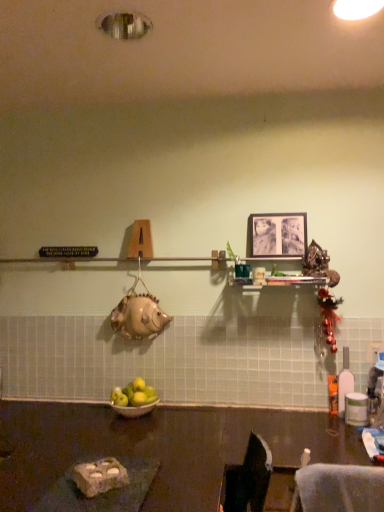
In order to face dark brown polished table at lower center, should I rotate leftwards or rightwards?

To align with it, rotate left about 2.910°.

Where is `dark brown polished table at lower center`? dark brown polished table at lower center is located at coordinates (160, 447).

Which object is wider, green matte apples at center or silver metallic bowl at center?

silver metallic bowl at center is wider.

Is green matte apples at center touching silver metallic bowl at center?

Yes.

Can you tell me how much green matte apples at center and silver metallic bowl at center differ in facing direction?

0.000387 degrees.

Is silver metallic bowl at center at the back of green matte apples at center?

No, silver metallic bowl at center is not at the back of green matte apples at center.

Who is taller, silver metallic bowl at center or translucent plastic bottle at right?

translucent plastic bottle at right is taller.

Is silver metallic bowl at center bigger than translucent plastic bottle at right?

Yes.

Is translucent plastic bottle at right a part of silver metallic bowl at center?

No.

Is silver metallic bowl at center far from translucent plastic bottle at right?

No, silver metallic bowl at center is not far away from translucent plastic bottle at right.

Is translucent plastic bottle at right bigger than dark brown polished table at lower center?

Incorrect, translucent plastic bottle at right is not larger than dark brown polished table at lower center.

From the image's perspective, is translucent plastic bottle at right on dark brown polished table at lower center?

Indeed, from the image's perspective, translucent plastic bottle at right is shown above dark brown polished table at lower center.

Is translucent plastic bottle at right taller or shorter than dark brown polished table at lower center?

Considering their sizes, translucent plastic bottle at right has less height than dark brown polished table at lower center.

From a real-world perspective, relative to dark brown polished table at lower center, is translucent plastic bottle at right vertically above or below?

Clearly, from a real-world perspective, translucent plastic bottle at right is above dark brown polished table at lower center.

Is silver metallic bowl at center taller than green matte apples at center?

No, silver metallic bowl at center is not taller than green matte apples at center.

Is silver metallic bowl at center oriented towards green matte apples at center?

No.

From a real-world perspective, relative to green matte apples at center, is silver metallic bowl at center vertically above or below?

silver metallic bowl at center is below green matte apples at center.

Is silver metallic bowl at center to the left of green matte apples at center from the viewer's perspective?

In fact, silver metallic bowl at center is to the right of green matte apples at center.

Where is `table on the left side of black matte picture frame at upper center`? This screenshot has width=384, height=512. table on the left side of black matte picture frame at upper center is located at coordinates (160, 447).

Can you confirm if dark brown polished table at lower center is positioned to the left of black matte picture frame at upper center?

Yes.

Is point (77, 426) closer or farther from the camera than point (288, 247)?

Clearly, point (77, 426) is closer to the camera than point (288, 247).

From a real-world perspective, who is located higher, black matte picture frame at upper center or dark brown polished table at lower center?

black matte picture frame at upper center, from a real-world perspective.

Considering the relative positions of black matte picture frame at upper center and dark brown polished table at lower center in the image provided, is black matte picture frame at upper center to the right of dark brown polished table at lower center from the viewer's perspective?

Indeed, black matte picture frame at upper center is positioned on the right side of dark brown polished table at lower center.

Who is taller, black matte picture frame at upper center or dark brown polished table at lower center?

With more height is dark brown polished table at lower center.

In order to click on table in front of the translucent plastic bottle at right in this screenshot , I will do `click(160, 447)`.

Can you confirm if dark brown polished table at lower center is bigger than translucent plastic bottle at right?

Correct, dark brown polished table at lower center is larger in size than translucent plastic bottle at right.

Is translucent plastic bottle at right at the back of dark brown polished table at lower center?

No, translucent plastic bottle at right is not at the back of dark brown polished table at lower center.

Which is closer to the camera, (340,440) or (347,351)?

The point (340,440) is closer.

The width and height of the screenshot is (384, 512). Find the location of `apple positioned vertically above the silver metallic bowl at center (from a real-world perspective)`. apple positioned vertically above the silver metallic bowl at center (from a real-world perspective) is located at coordinates (133, 394).

Find the location of a particular element. The width and height of the screenshot is (384, 512). bottle lying above the silver metallic bowl at center (from the image's perspective) is located at coordinates (344, 382).

From the image, which object appears to be nearer to dark brown polished table at lower center, green matte apples at center or translucent plastic bottle at right?

Based on the image, green matte apples at center appears to be nearer to dark brown polished table at lower center.

Looking at the image, which one is located closer to dark brown polished table at lower center, black matte picture frame at upper center or translucent plastic bottle at right?

translucent plastic bottle at right lies closer to dark brown polished table at lower center than the other object.

Based on their spatial positions, is silver metallic bowl at center or black matte picture frame at upper center closer to dark brown polished table at lower center?

silver metallic bowl at center.

Estimate the real-world distances between objects in this image. Which object is closer to green matte apples at center, black matte picture frame at upper center or silver metallic bowl at center?

The object closer to green matte apples at center is silver metallic bowl at center.

Looking at the image, which one is located further to dark brown polished table at lower center, silver metallic bowl at center or translucent plastic bottle at right?

translucent plastic bottle at right is further to dark brown polished table at lower center.

Looking at the image, which one is located further to translucent plastic bottle at right, silver metallic bowl at center or green matte apples at center?

Based on the image, green matte apples at center appears to be further to translucent plastic bottle at right.

Consider the image. Considering their positions, is translucent plastic bottle at right positioned closer to dark brown polished table at lower center than silver metallic bowl at center?

Based on the image, silver metallic bowl at center appears to be nearer to dark brown polished table at lower center.

Which object lies further to the anchor point green matte apples at center, translucent plastic bottle at right or black matte picture frame at upper center?

Among the two, black matte picture frame at upper center is located further to green matte apples at center.

Locate an element on the screen. picture frame between silver metallic bowl at center and translucent plastic bottle at right in the horizontal direction is located at coordinates (277, 234).

You are a GUI agent. You are given a task and a screenshot of the screen. Output one action in this format:
    pyautogui.click(x=<x>, y=<y>)
    Task: Click on the bowl positioned between dark brown polished table at lower center and green matte apples at center from near to far
    
    Given the screenshot: What is the action you would take?
    pyautogui.click(x=134, y=409)

I want to click on bowl between black matte picture frame at upper center and dark brown polished table at lower center in the up-down direction, so click(134, 409).

At what (x,y) coordinates should I click in order to perform the action: click on bowl between green matte apples at center and translucent plastic bottle at right in the horizontal direction. Please return your answer as a coordinate pair (x, y). The height and width of the screenshot is (512, 384). Looking at the image, I should click on (134, 409).